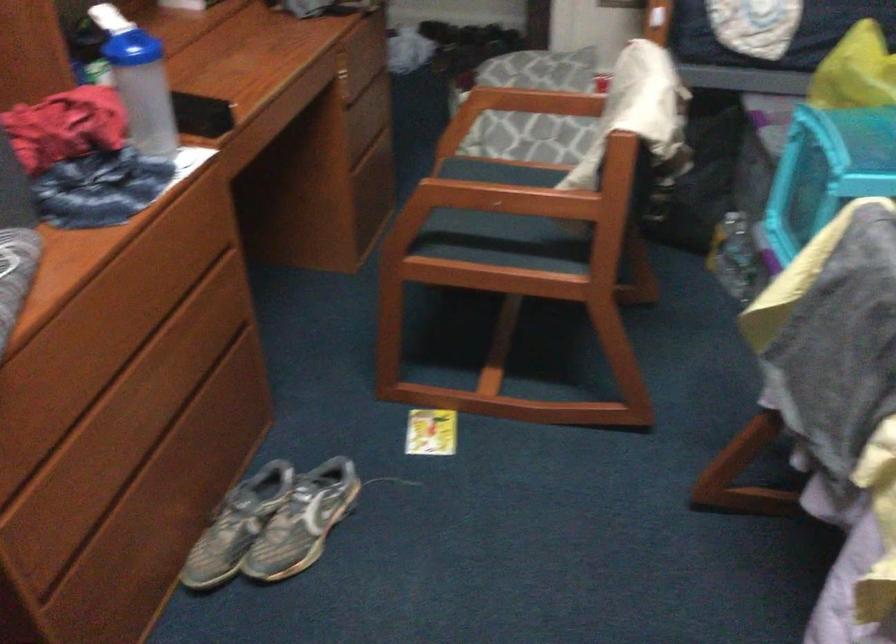
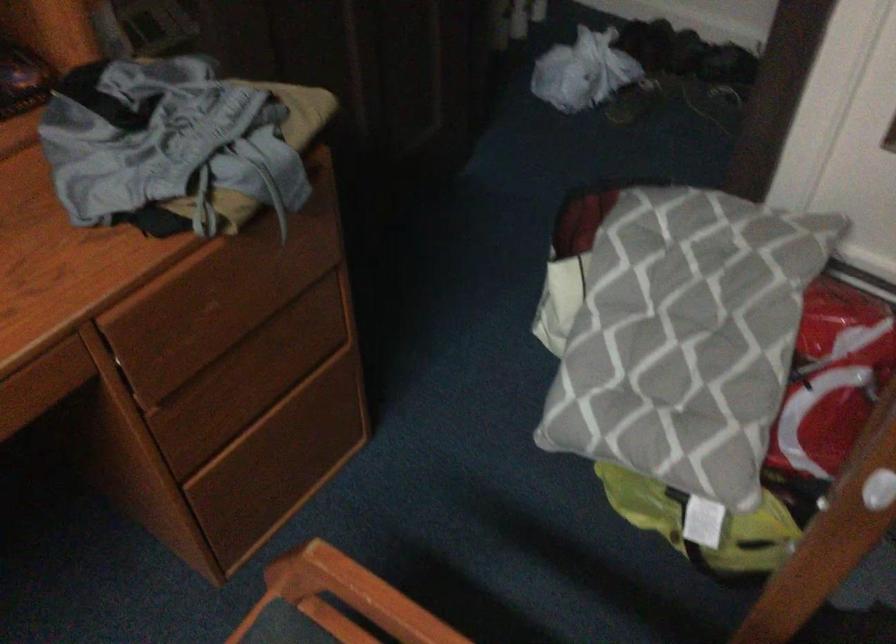
Question: The images are taken continuously from a first-person perspective. In which direction are you moving?

Choices:
 (A) Left
 (B) Right
 (C) Forward
 (D) Backward

Answer: (C)